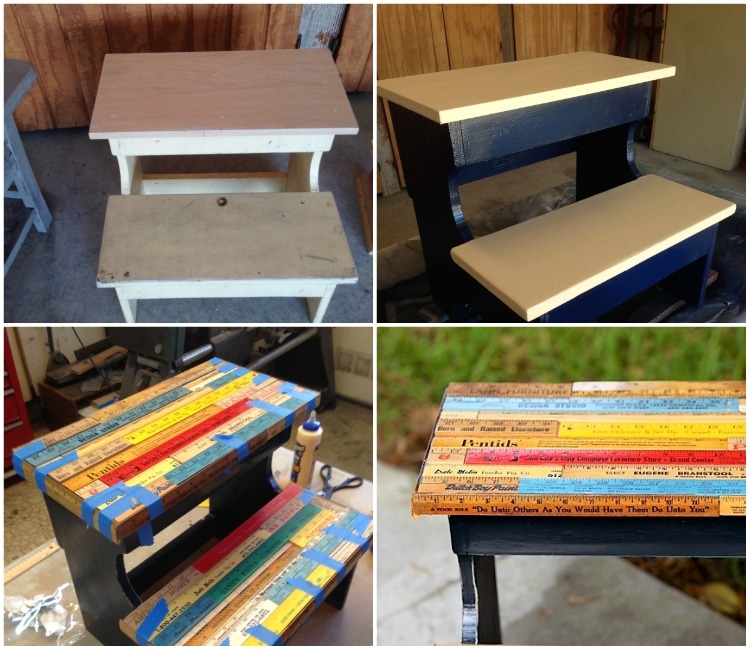
At what (x,y) coordinates should I click in order to perform the action: click on wood wall. Please return your answer as a coordinate pair (x, y). The height and width of the screenshot is (650, 750). Looking at the image, I should click on (262, 25), (430, 25).